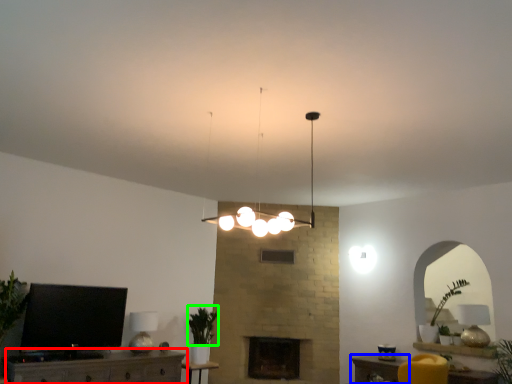
Question: Which is nearer to the furniture (highlighted by a red box)? table (highlighted by a blue box) or plant (highlighted by a green box).

Choices:
 (A) table
 (B) plant

Answer: (B)